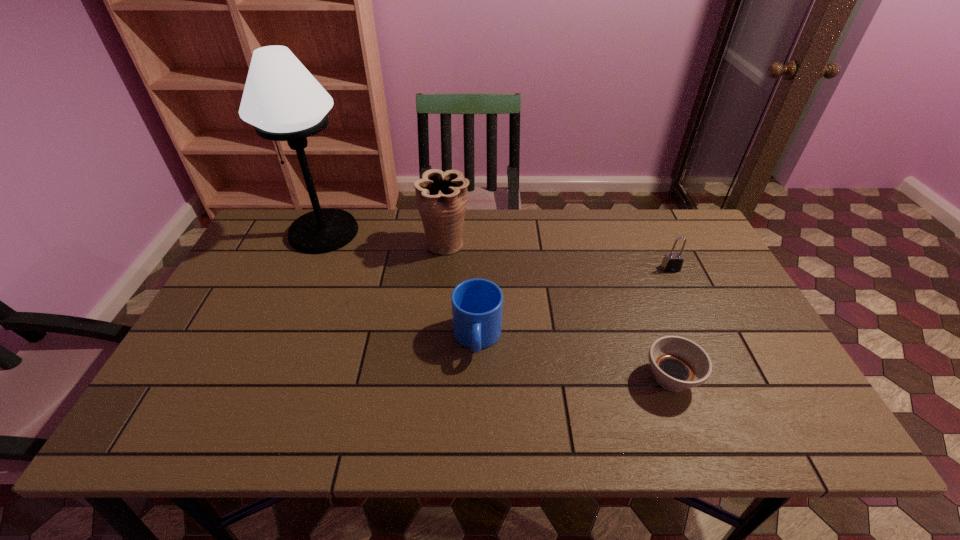
Point out which object is positioned as the nearest to the padlock. Please provide its 2D coordinates. Your answer should be formatted as a tuple, i.e. [(x, y)], where the tuple contains the x and y coordinates of a point satisfying the conditions above.

[(678, 363)]

Where is `object that is the second closest to the shortest object`? object that is the second closest to the shortest object is located at coordinates (477, 304).

I want to click on vacant area in the image that satisfies the following two spatial constraints: 1. on the front side of the urn; 2. on the left side of the shortest object, so click(x=433, y=379).

Find the location of a particular element. The image size is (960, 540). vacant space that satisfies the following two spatial constraints: 1. on the side of the soup bowl with the handle; 2. on the right side of the mug is located at coordinates (477, 379).